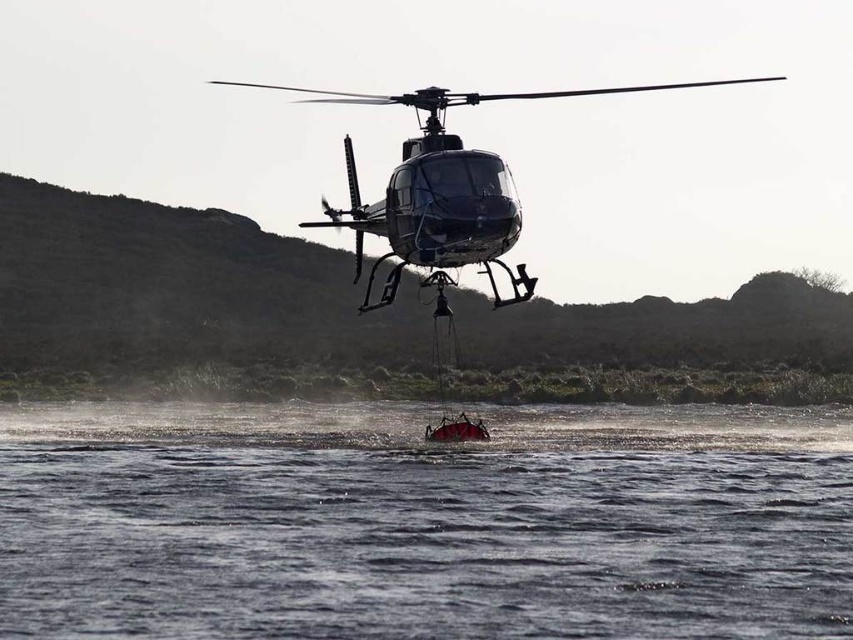
You are a pilot in a helicopter and you need to lower a rescue boat to the water. Based on the scene, which object is closer to the water surface between the red rubber boat at lower center and the metallic dark gray helicopter at center?

The red rubber boat at lower center is closer to the water surface because it is in front of the metallic dark gray helicopter at center, meaning it is positioned lower in the scene.

You are a pilot observing the scene from a nearby control tower. You need to determine which object, the metallic dark gray helicopter at center or the red matte boat at center, you can see more clearly from your vantage point. Based on their sizes, which one would appear bigger?

The metallic dark gray helicopter at center is larger in size than the red matte boat at center, so it would appear bigger from your vantage point.